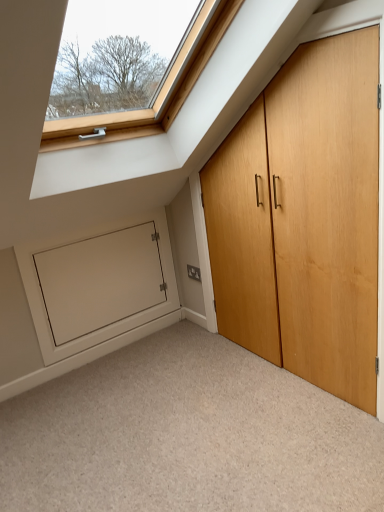
Question: From a real-world perspective, is white matte door at lower left positioned above or below carpeted floor at lower center?

Choices:
 (A) above
 (B) below

Answer: (A)

Question: Relative to carpeted floor at lower center, is white matte door at lower left in front or behind?

Choices:
 (A) front
 (B) behind

Answer: (B)

Question: Considering the real-world distances, which object is closest to the light brown wood door at right?

Choices:
 (A) white matte door at lower left
 (B) carpeted floor at lower center

Answer: (B)

Question: Estimate the real-world distances between objects in this image. Which object is farther from the white matte door at lower left?

Choices:
 (A) carpeted floor at lower center
 (B) light brown wood door at right

Answer: (B)